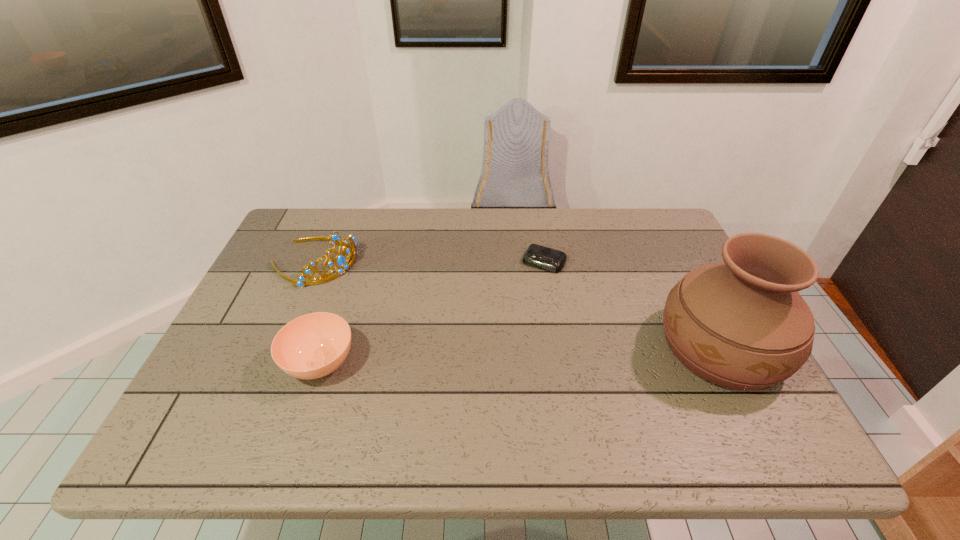
Find the location of a particular element. This screenshot has height=540, width=960. the second shortest object is located at coordinates (312, 346).

Where is `the rightmost object`? the rightmost object is located at coordinates (742, 324).

This screenshot has width=960, height=540. I want to click on the tallest object, so click(x=742, y=324).

I want to click on the third object from left to right, so click(538, 256).

Locate an element on the screen. This screenshot has width=960, height=540. the shortest object is located at coordinates (538, 256).

The width and height of the screenshot is (960, 540). Identify the location of tiara. (x=340, y=260).

Identify the location of vacant region located on the back of the soup bowl. (357, 252).

The height and width of the screenshot is (540, 960). Identify the location of vacant space located 0.280m on the back of the tallest object. [x=665, y=239].

The height and width of the screenshot is (540, 960). Find the location of `vacant region located 0.360m on the display of the third object from left to right`. vacant region located 0.360m on the display of the third object from left to right is located at coordinates (483, 366).

I want to click on free space located on the display of the third object from left to right, so click(475, 379).